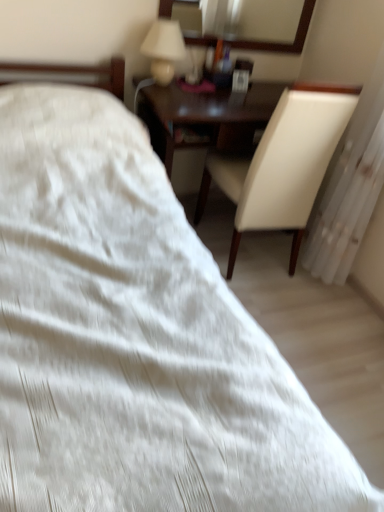
Question: Is matte white lampshade at upper center to the left or to the right of white leather chair at right in the image?

Choices:
 (A) left
 (B) right

Answer: (A)

Question: From a real-world perspective, relative to white leather chair at right, is matte white lampshade at upper center vertically above or below?

Choices:
 (A) above
 (B) below

Answer: (A)

Question: Estimate the real-world distances between objects in this image. Which object is closer to the white leather chair at right?

Choices:
 (A) matte white lampshade at upper center
 (B) white fabric radiator at right
 (C) wooden-framed mirror at upper center

Answer: (B)

Question: Which of these objects is positioned closest to the matte white lampshade at upper center?

Choices:
 (A) wooden-framed mirror at upper center
 (B) white leather chair at right
 (C) white fabric radiator at right

Answer: (A)